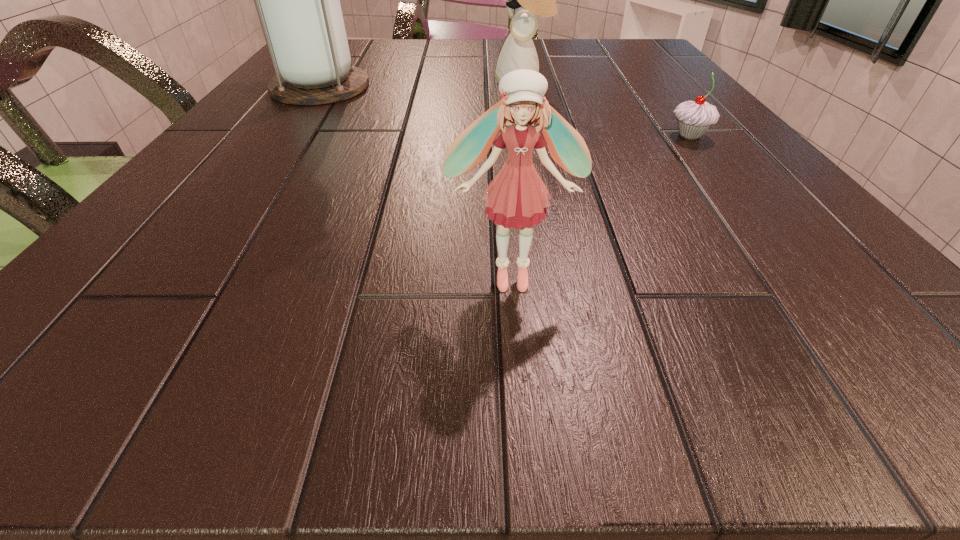
Find the location of a particular element. This screenshot has width=960, height=540. lantern is located at coordinates (298, 2).

Locate an element on the screen. Image resolution: width=960 pixels, height=540 pixels. the farther doll is located at coordinates (518, 52).

At what (x,y) coordinates should I click in order to perform the action: click on the nearer doll. Please return your answer as a coordinate pair (x, y). Image resolution: width=960 pixels, height=540 pixels. Looking at the image, I should click on (517, 197).

Identify the location of the shorter doll. (517, 197).

Locate an element on the screen. the shortest object is located at coordinates (693, 117).

I want to click on the rightmost object, so click(693, 117).

Find the location of a particular element. free space located on the right of the lantern is located at coordinates (453, 87).

At what (x,y) coordinates should I click in order to perform the action: click on blank area located at the front face of the taller doll. Please return your answer as a coordinate pair (x, y). This screenshot has width=960, height=540. Looking at the image, I should click on (339, 83).

Find the location of a particular element. This screenshot has height=540, width=960. free spot located at the front face of the taller doll is located at coordinates (408, 83).

Image resolution: width=960 pixels, height=540 pixels. What are the coordinates of `vacant space located at the front face of the taller doll` in the screenshot? It's located at (454, 83).